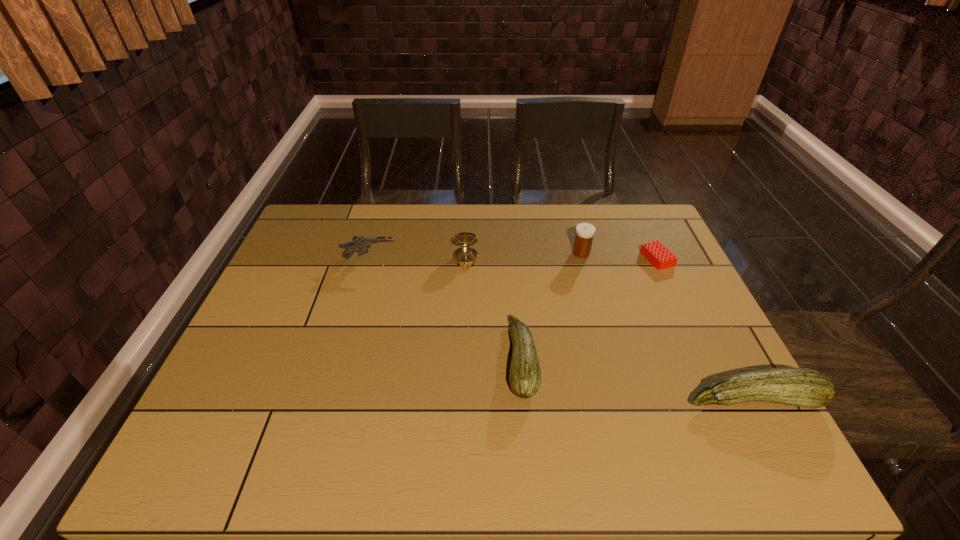
In the image, there is a desktop. Where is `free space at the left edge`? This screenshot has width=960, height=540. free space at the left edge is located at coordinates (262, 307).

Identify the location of free point at the right edge. The image size is (960, 540). point(724,349).

Locate an element on the screen. The image size is (960, 540). vacant space at the far left corner of the desktop is located at coordinates (300, 243).

What are the coordinates of `vacant space that's between the gun and the left zucchini` in the screenshot? It's located at (445, 309).

The image size is (960, 540). Identify the location of vacant point located between the shortest object and the gun. (514, 259).

This screenshot has height=540, width=960. Find the location of `free space between the gun and the taller zucchini`. free space between the gun and the taller zucchini is located at coordinates (562, 329).

Where is `vacant area that lies between the medicine and the taller zucchini`? vacant area that lies between the medicine and the taller zucchini is located at coordinates (667, 326).

Where is `free area in between the gun and the taller zucchini`? This screenshot has width=960, height=540. free area in between the gun and the taller zucchini is located at coordinates (562, 329).

What are the coordinates of `free area in between the taller zucchini and the medicine` in the screenshot? It's located at (667, 326).

The width and height of the screenshot is (960, 540). What are the coordinates of `vacant area that lies between the fifth tallest object and the shortest object` in the screenshot? It's located at (589, 309).